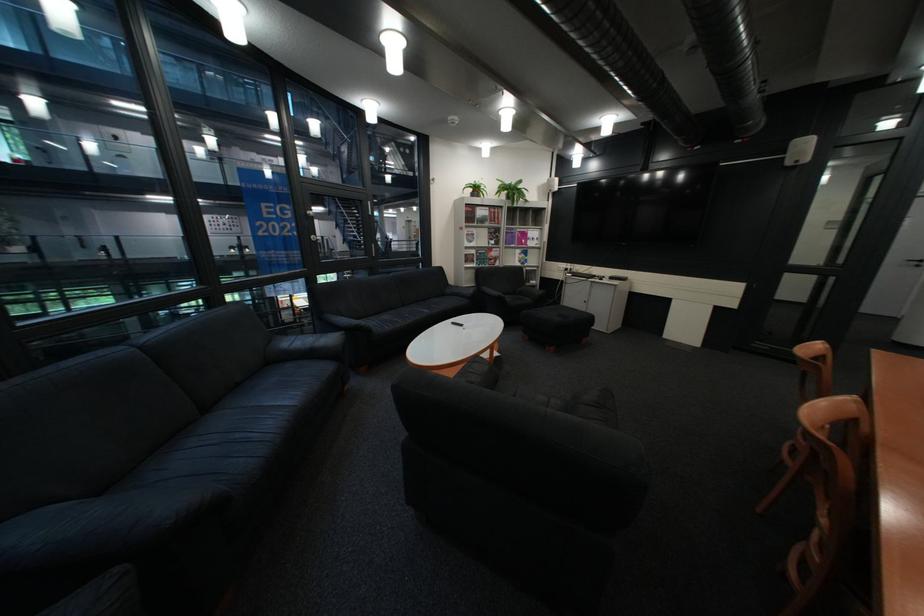
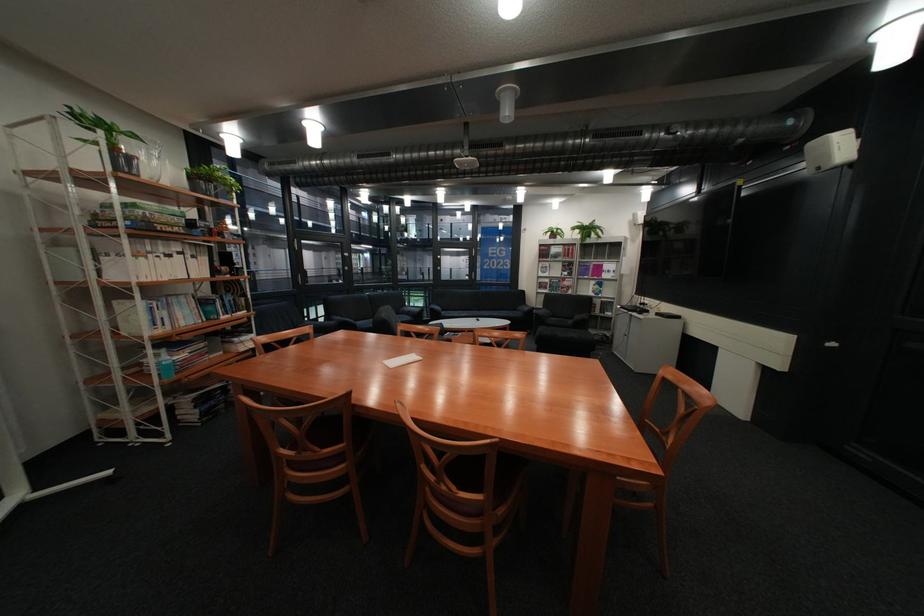
Where in the second image is the point corresponding to point 458,294 from the first image?

(531, 310)